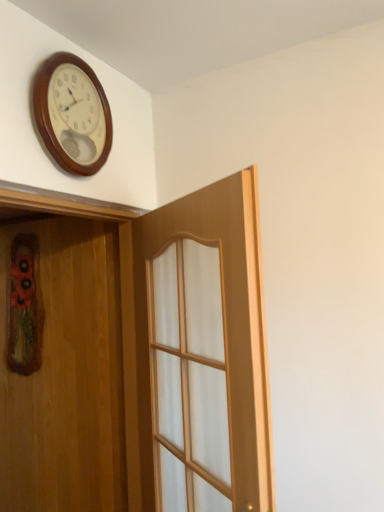
Question: Could you tell me if wooden door at left, placed as the 2th door when sorted from right to left, is turned towards light wood door at center, acting as the second door starting from the left?

Choices:
 (A) no
 (B) yes

Answer: (B)

Question: Is wooden door at left, placed as the 2th door when sorted from right to left, located outside light wood door at center, acting as the second door starting from the left?

Choices:
 (A) no
 (B) yes

Answer: (B)

Question: Does wooden door at left, placed as the 2th door when sorted from right to left, have a lesser height compared to light wood door at center, which is counted as the first door, starting from the right?

Choices:
 (A) no
 (B) yes

Answer: (A)

Question: From a real-world perspective, is wooden door at left, placed as the 2th door when sorted from right to left, located beneath light wood door at center, acting as the second door starting from the left?

Choices:
 (A) no
 (B) yes

Answer: (A)

Question: From a real-world perspective, does wooden door at left, the 1th door in the left-to-right sequence, stand above light wood door at center, which is counted as the first door, starting from the right?

Choices:
 (A) yes
 (B) no

Answer: (A)

Question: In terms of size, does light wood door at center, acting as the second door starting from the left, appear bigger or smaller than wooden door at left, the 1th door in the left-to-right sequence?

Choices:
 (A) small
 (B) big

Answer: (B)

Question: Is point (193, 212) positioned closer to the camera than point (16, 495)?

Choices:
 (A) closer
 (B) farther

Answer: (A)

Question: From the image's perspective, is light wood door at center, which is counted as the first door, starting from the right, located above or below wooden door at left, the 1th door in the left-to-right sequence?

Choices:
 (A) below
 (B) above

Answer: (B)

Question: From a real-world perspective, relative to wooden door at left, the 1th door in the left-to-right sequence, is light wood door at center, acting as the second door starting from the left, vertically above or below?

Choices:
 (A) below
 (B) above

Answer: (A)

Question: Is wooden door at left, placed as the 2th door when sorted from right to left, in front of or behind wooden wall clock at upper left in the image?

Choices:
 (A) front
 (B) behind

Answer: (A)

Question: Is point tap(112, 420) positioned closer to the camera than point tap(33, 96)?

Choices:
 (A) closer
 (B) farther

Answer: (B)

Question: Is wooden door at left, placed as the 2th door when sorted from right to left, taller or shorter than wooden wall clock at upper left?

Choices:
 (A) tall
 (B) short

Answer: (A)

Question: In terms of size, does wooden door at left, the 1th door in the left-to-right sequence, appear bigger or smaller than wooden wall clock at upper left?

Choices:
 (A) small
 (B) big

Answer: (B)

Question: From the image's perspective, relative to light wood door at center, which is counted as the first door, starting from the right, is wooden wall clock at upper left above or below?

Choices:
 (A) below
 (B) above

Answer: (B)

Question: Considering the positions of point (54, 138) and point (100, 369), is point (54, 138) closer or farther from the camera than point (100, 369)?

Choices:
 (A) closer
 (B) farther

Answer: (A)